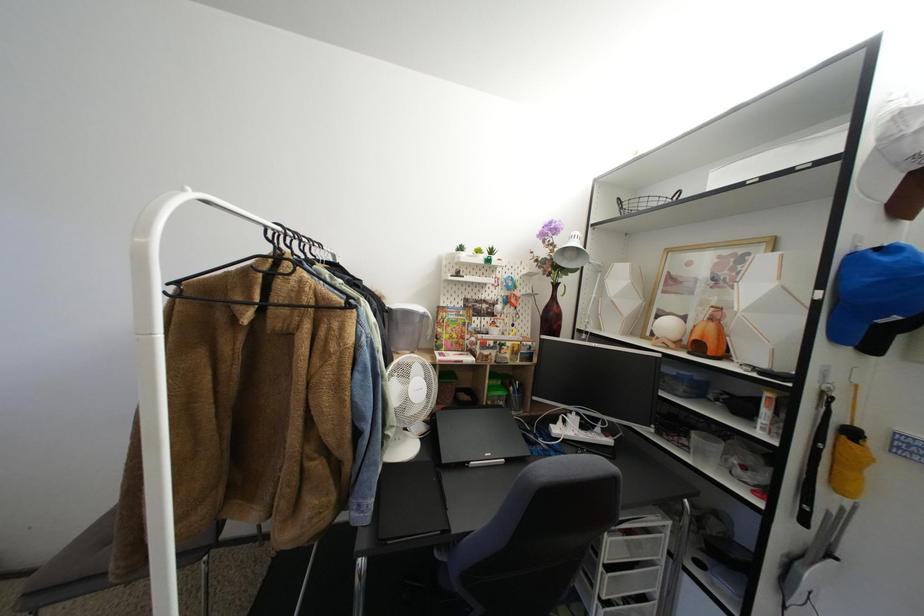
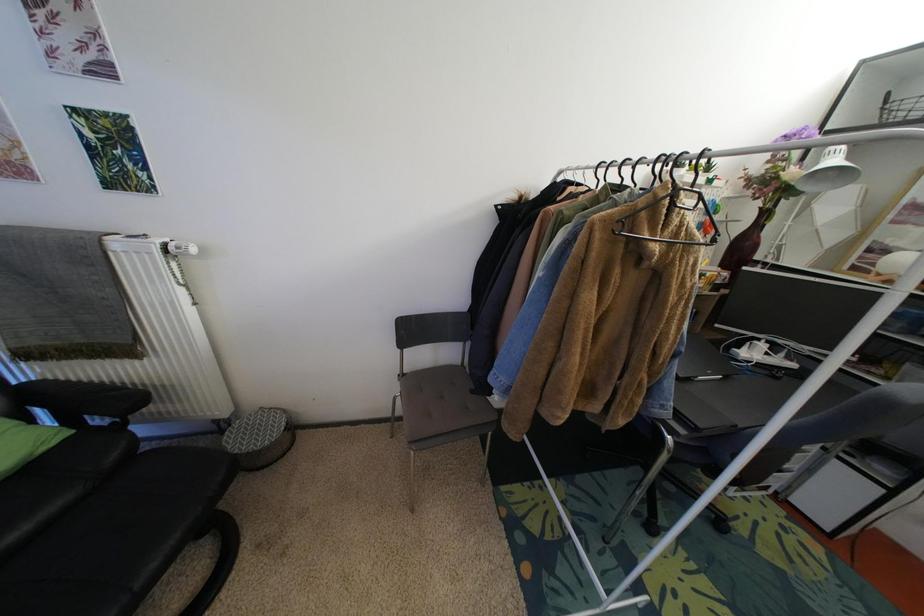
Question: Which direction would the cameraman need to move to produce the second image? Reply with the corresponding letter.

Choices:
 (A) Left
 (B) Right
 (C) Forward
 (D) Backward

Answer: (A)